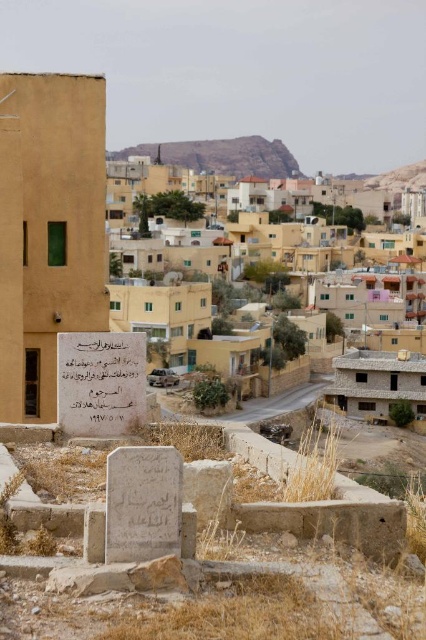
Is beige stone buildings at center shorter than brown rocky hillside at upper center?

In fact, beige stone buildings at center may be taller than brown rocky hillside at upper center.

You are a GUI agent. You are given a task and a screenshot of the screen. Output one action in this format:
    pyautogui.click(x=<x>, y=<y>)
    Task: Click on the beige stone buildings at center
    
    Given the screenshot: What is the action you would take?
    pyautogui.click(x=307, y=241)

Where is `beige stone buildings at center`? beige stone buildings at center is located at coordinates (307, 241).

Does stone inscription at center have a greater height compared to brown rocky hillside at upper center?

In fact, stone inscription at center may be shorter than brown rocky hillside at upper center.

Which is behind, point (132, 394) or point (210, 147)?

Positioned behind is point (210, 147).

The height and width of the screenshot is (640, 426). What are the coordinates of `stone inscription at center` in the screenshot? It's located at (100, 381).

Based on the photo, how much distance is there between beige stone buildings at center and stone inscription at center?

beige stone buildings at center is 432.33 feet away from stone inscription at center.

Can you confirm if beige stone buildings at center is positioned below stone inscription at center?

Actually, beige stone buildings at center is above stone inscription at center.

Locate an element on the screen. This screenshot has height=640, width=426. beige stone buildings at center is located at coordinates (307, 241).